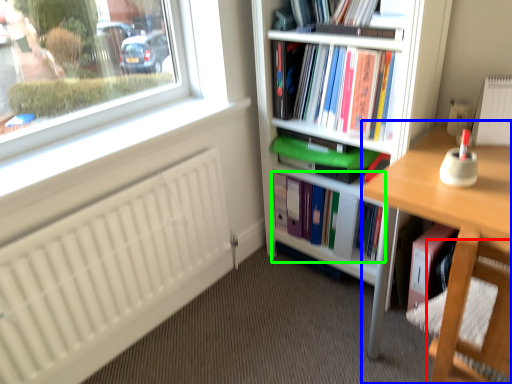
Question: Based on their relative distances, which object is nearer to swivel chair (highlighted by a red box)? Choose from desk (highlighted by a blue box) and book (highlighted by a green box).

Choices:
 (A) desk
 (B) book

Answer: (A)